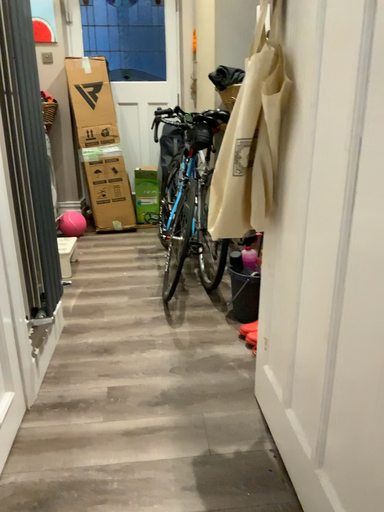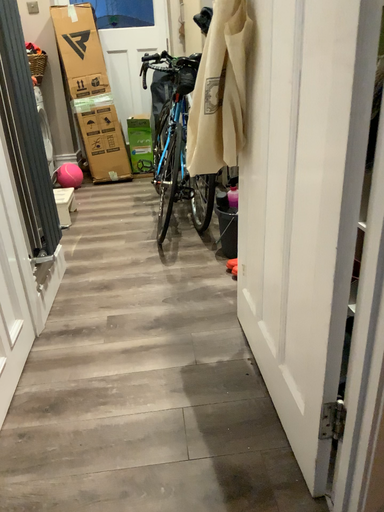
Question: Which way did the camera rotate in the video?

Choices:
 (A) rotated upward
 (B) rotated downward

Answer: (B)